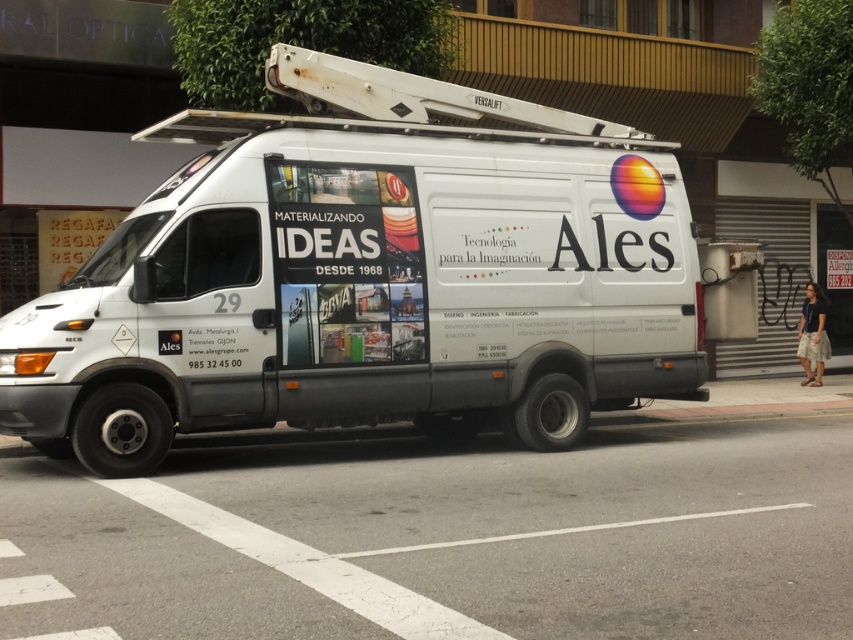
You are a delivery driver who needs to park your vehicle in a spot that is exactly at the coordinates point (368, 276). According to the scene, is there an object already occupying that location?

Yes, the white matte van at center is represented by point (368, 276), so that location is already occupied by the van.

You are a delivery driver who needs to park your vehicle next to the white matte van at center to unload packages. However, there is a matte paper poster at center in the way. Can you move the poster to make space for your vehicle?

The white matte van at center is smaller than the matte paper poster at center, so moving the poster might be necessary to create enough space for your vehicle.